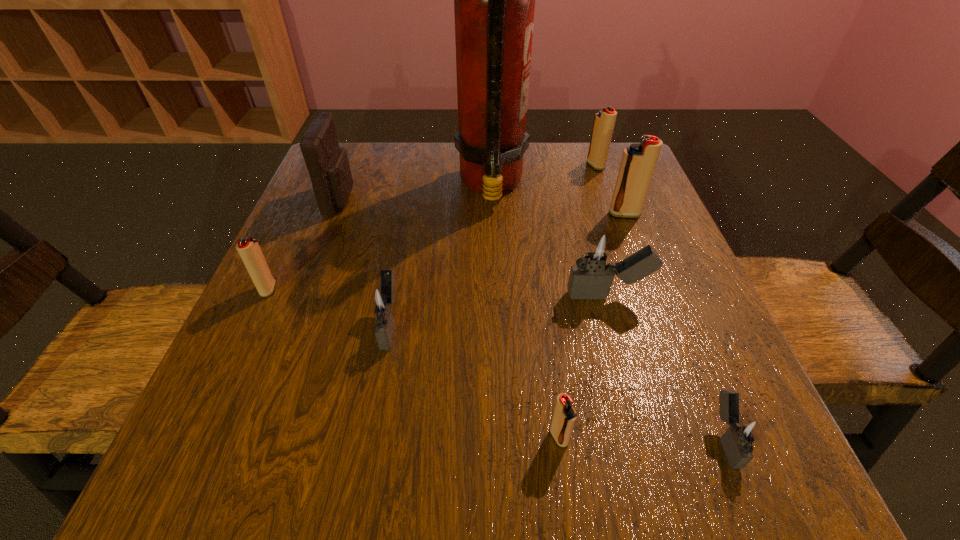
The image size is (960, 540). What are the coordinates of `pouch positioned at the left edge` in the screenshot? It's located at (327, 163).

Find the location of a particular element. Image resolution: width=960 pixels, height=540 pixels. igniter situated at the left edge is located at coordinates (249, 250).

Identify the location of object that is at the far left corner. (327, 163).

The width and height of the screenshot is (960, 540). In order to click on object situated at the far right corner in this screenshot , I will do `click(604, 121)`.

Identify the location of object that is at the near right corner. This screenshot has width=960, height=540. (746, 433).

You are a GUI agent. You are given a task and a screenshot of the screen. Output one action in this format:
    pyautogui.click(x=<x>, y=<y>)
    Task: Click on the free space at the far edge of the desktop
    
    Given the screenshot: What is the action you would take?
    pyautogui.click(x=416, y=152)

You are a GUI agent. You are given a task and a screenshot of the screen. Output one action in this format:
    pyautogui.click(x=<x>, y=<y>)
    Task: Click on the blank space at the near edge of the desktop
    Image resolution: width=960 pixels, height=540 pixels.
    Given the screenshot: What is the action you would take?
    pyautogui.click(x=649, y=481)

The height and width of the screenshot is (540, 960). Identify the location of vacant region at the left edge of the desktop. (316, 300).

Locate an element on the screen. The image size is (960, 540). vacant area at the right edge is located at coordinates (671, 280).

Locate an element on the screen. The width and height of the screenshot is (960, 540). vacant space at the far left corner of the desktop is located at coordinates (351, 152).